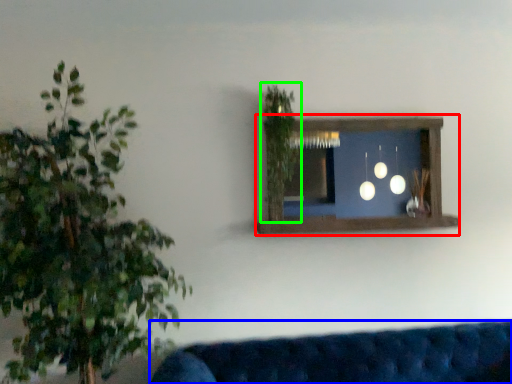
Question: Considering the real-world distances, which object is closest to window frame (highlighted by a red box)? studio couch (highlighted by a blue box) or plant (highlighted by a green box).

Choices:
 (A) studio couch
 (B) plant

Answer: (B)